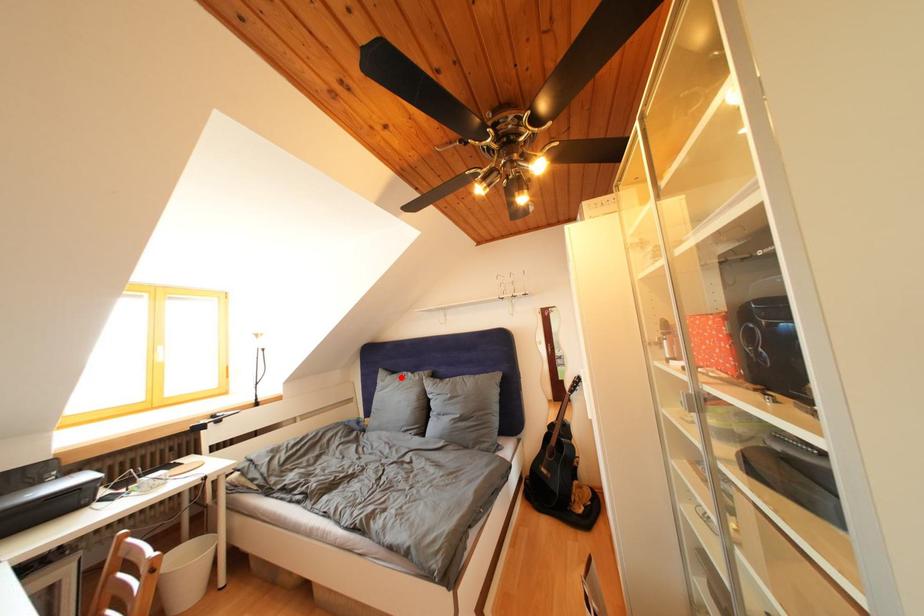
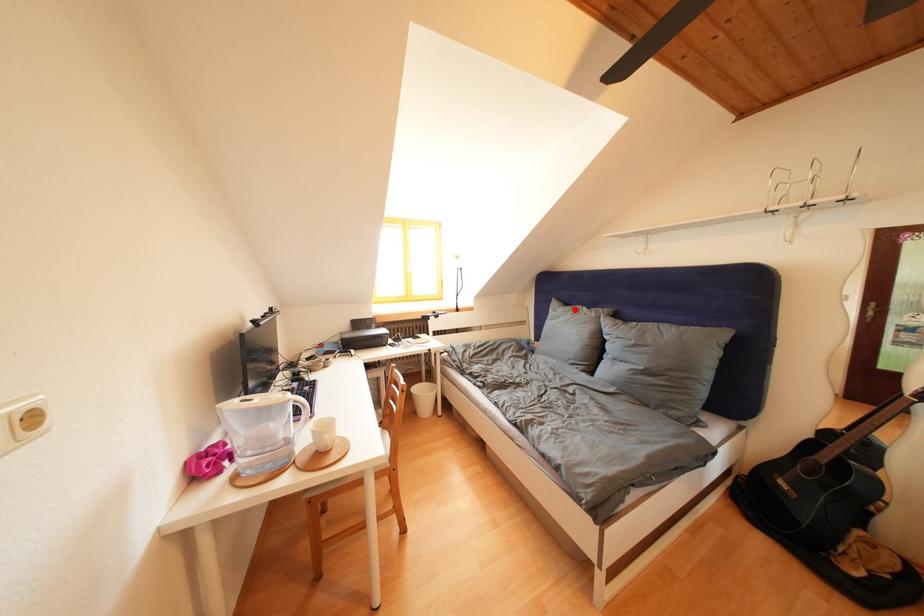
Based on the photo, I am providing you with two images of the same scene from different viewpoints. A red point is marked on the first image and another point is marked on the second image. Is the red point in image1 aligned with the point shown in image2?

Yes